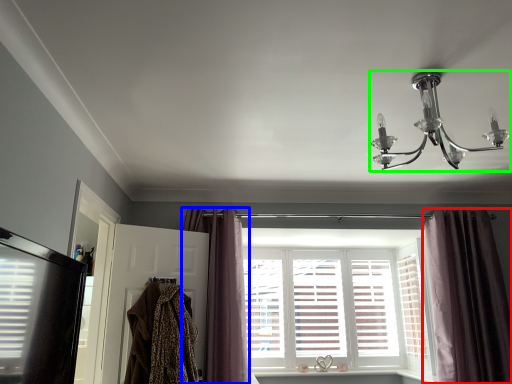
Question: Based on their relative distances, which object is nearer to curtain (highlighted by a red box)? Choose from curtain (highlighted by a blue box) and lamp (highlighted by a green box).

Choices:
 (A) curtain
 (B) lamp

Answer: (B)